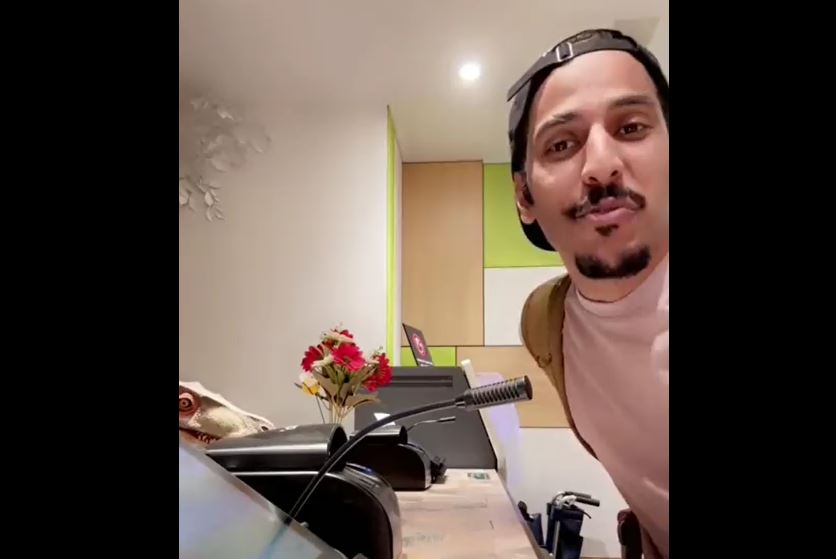
Where is `wall`? wall is located at coordinates (426, 238).